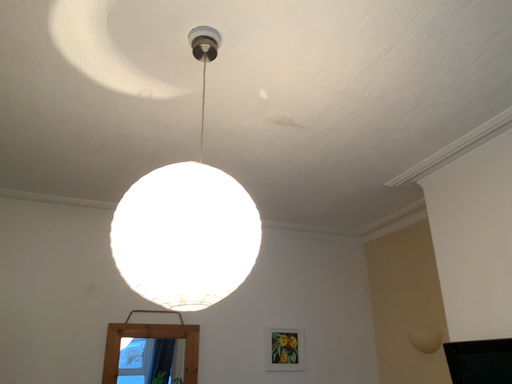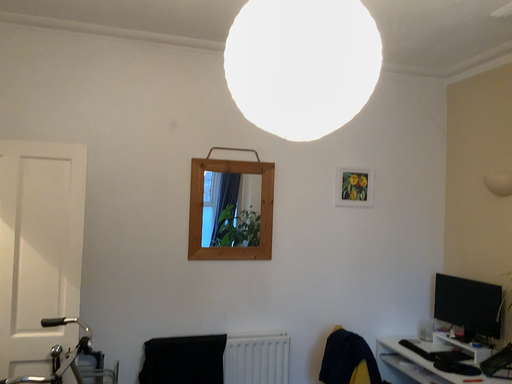
Question: How did the camera likely rotate when shooting the video?

Choices:
 (A) rotated right
 (B) rotated left

Answer: (B)